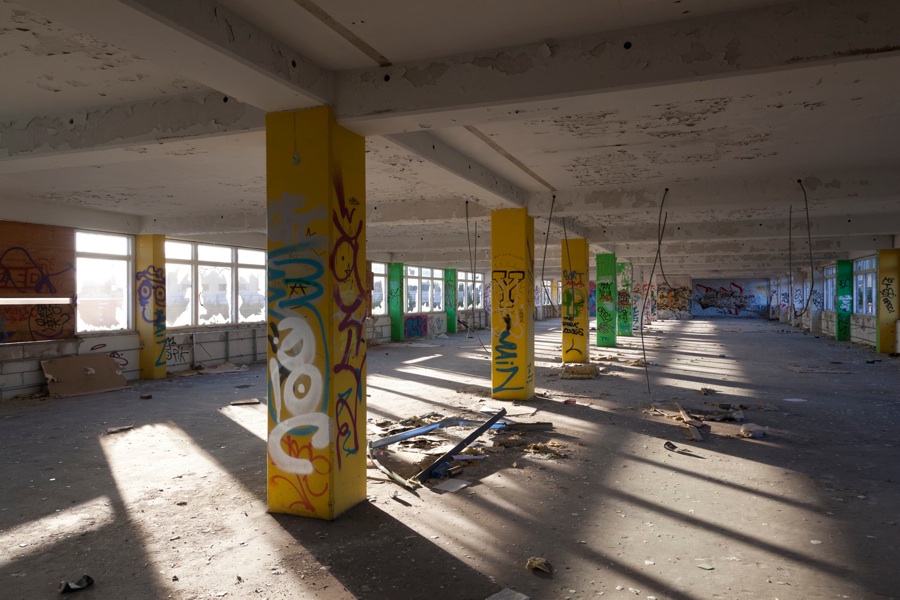
Image resolution: width=900 pixels, height=600 pixels. I want to click on pillars, so click(146, 305), click(322, 336), click(516, 318), click(590, 313), click(613, 305), click(624, 302), click(838, 285), click(888, 296).